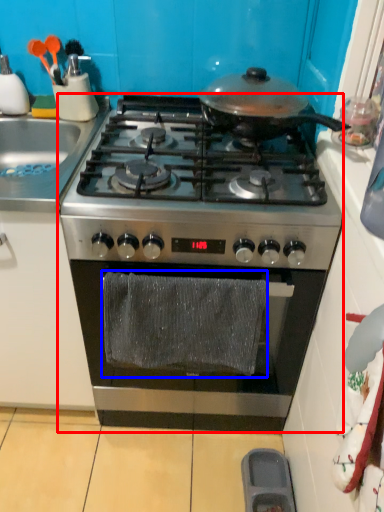
Question: Which point is closer to the camera, gas stove (highlighted by a red box) or material (highlighted by a blue box)?

Choices:
 (A) gas stove
 (B) material

Answer: (B)